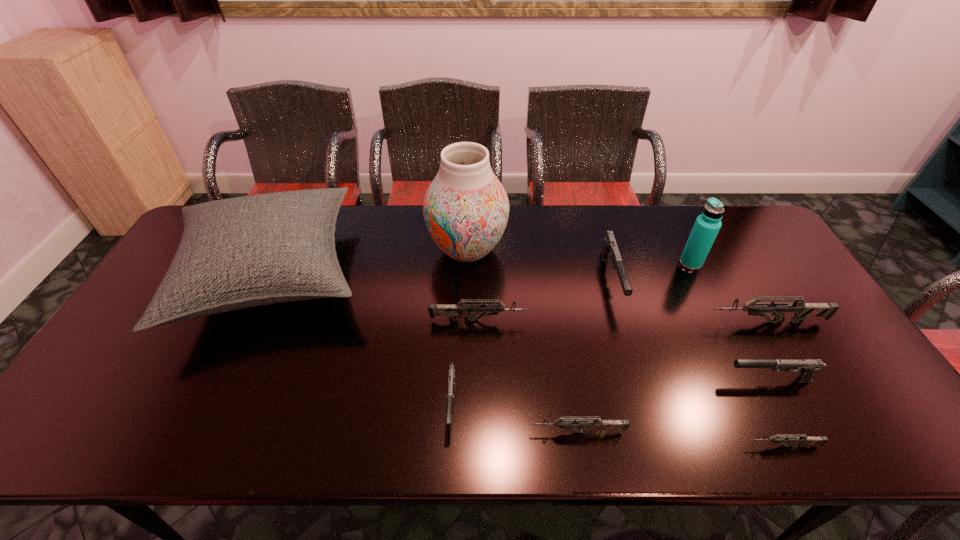
The image size is (960, 540). I want to click on the nearest object, so (x=779, y=438).

Image resolution: width=960 pixels, height=540 pixels. I want to click on the smallest grey gun, so click(779, 438).

Where is `vacant space situated 0.200m on the front of the vase`? vacant space situated 0.200m on the front of the vase is located at coordinates (465, 329).

I want to click on vacant space situated on the left of the blue water bottle, so click(x=571, y=263).

Find the location of a particular element. free region located 0.050m on the front of the cushion is located at coordinates (223, 375).

Locate an element on the screen. This screenshot has height=540, width=960. free space located 0.310m at the muzzle end of the fourth gun from left to right is located at coordinates (653, 417).

This screenshot has height=540, width=960. I want to click on vacant space located aimed along the barrel of the biggest grey gun, so click(584, 322).

This screenshot has height=540, width=960. Identify the location of vacant area located 0.060m aimed along the barrel of the biggest grey gun. (685, 322).

Where is `free space located aimed along the barrel of the biggest grey gun`? free space located aimed along the barrel of the biggest grey gun is located at coordinates [667, 322].

You are a GUI agent. You are given a task and a screenshot of the screen. Output one action in this format:
    pyautogui.click(x=<x>, y=<y>)
    Task: Click on the vacant space located 0.190m aimed along the barrel of the second biggest grey gun
    The image size is (960, 540).
    Given the screenshot: What is the action you would take?
    [596, 320]